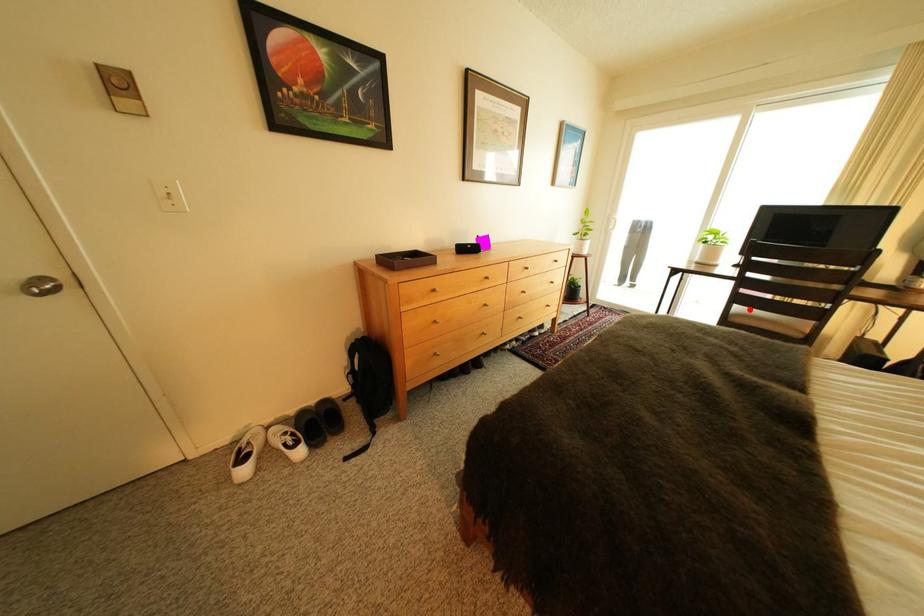
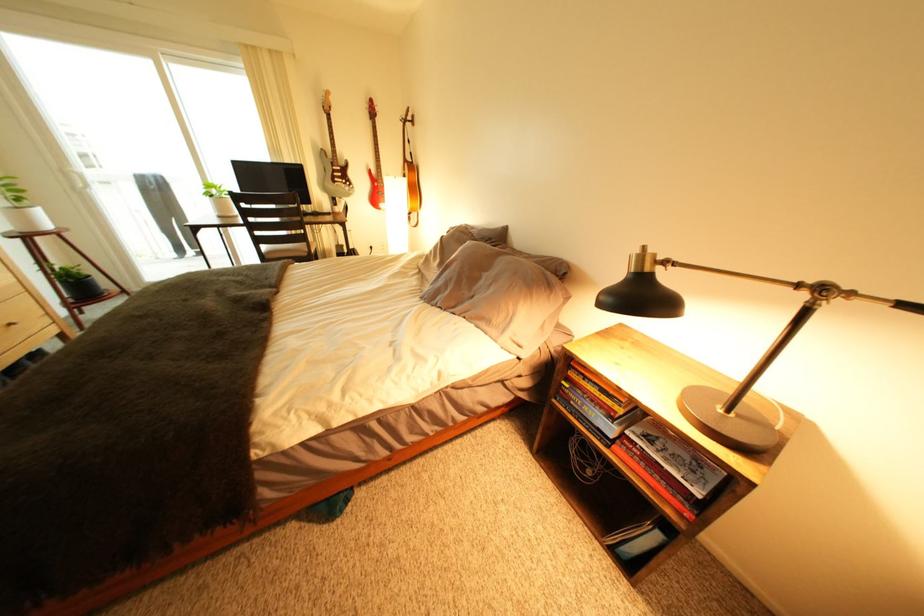
Question: I am providing you with two images of the same scene from different viewpoints. Image1 has a red point marked. In image2, the corresponding 3D location appears at what relative position? Reply with the corresponding letter.

Choices:
 (A) Closer
 (B) Farther

Answer: (A)